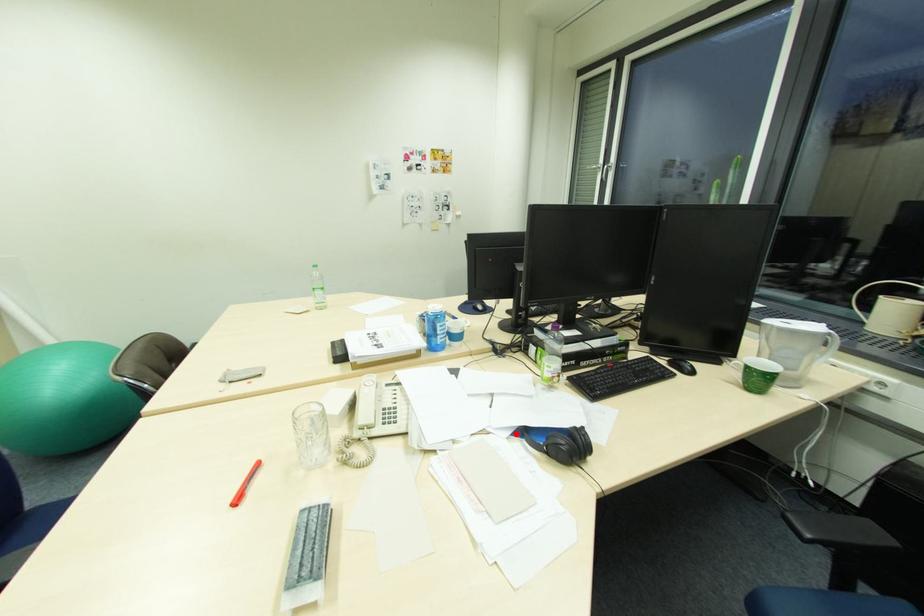
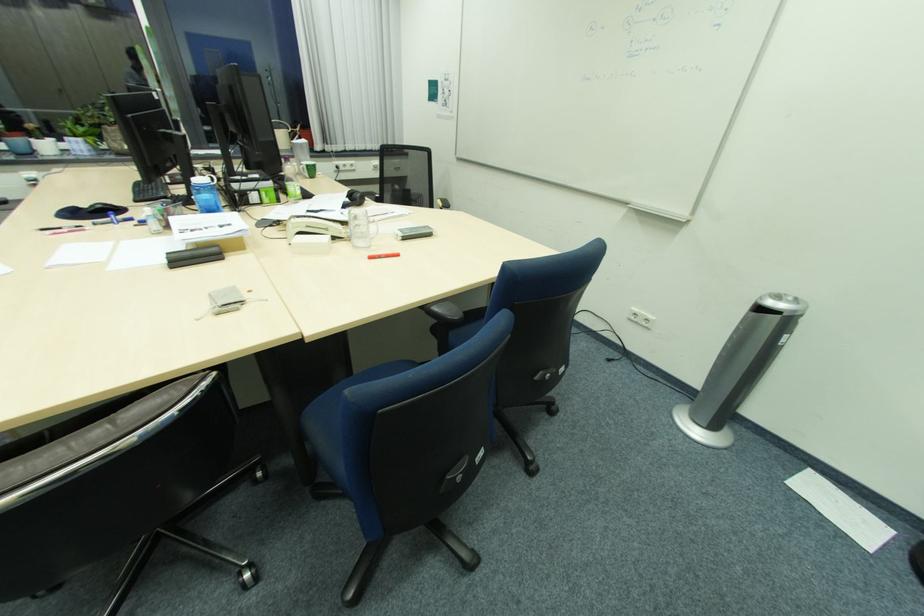
Question: I am providing you with two images of the same scene from different viewpoints. A red point is shown in image1. For the corresponding object point in image2, is it positioned nearer or farther from the camera?

Choices:
 (A) Nearer
 (B) Farther

Answer: (B)